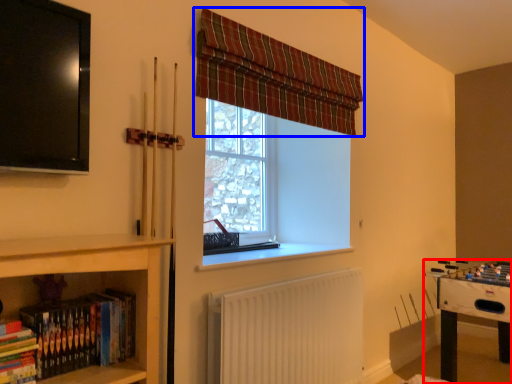
Question: Which point is closer to the camera, table (highlighted by a red box) or curtain (highlighted by a blue box)?

Choices:
 (A) table
 (B) curtain

Answer: (B)